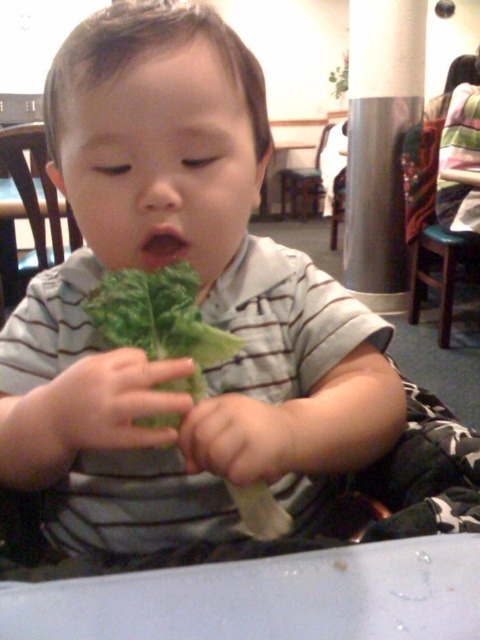
Measure the distance between point (447, 256) and camera.

Point (447, 256) is 2.46 meters away from camera.

In the scene shown: Who is lower down, green fabric chair at right or metallic silver chair at upper center?

green fabric chair at right is below.

Which is behind, point (422, 147) or point (285, 173)?

Positioned behind is point (285, 173).

Find the location of `green fabric chair at right`. green fabric chair at right is located at coordinates (432, 227).

Does green leafy at center appear on the left side of metallic silver chair at upper center?

Yes, green leafy at center is to the left of metallic silver chair at upper center.

Locate an element on the screen. Image resolution: width=480 pixels, height=640 pixels. green leafy at center is located at coordinates (159, 321).

Between wooden chair at left and metallic silver chair at upper center, which one has less height?

With less height is wooden chair at left.

The height and width of the screenshot is (640, 480). What are the coordinates of `wooden chair at left` in the screenshot? It's located at (36, 193).